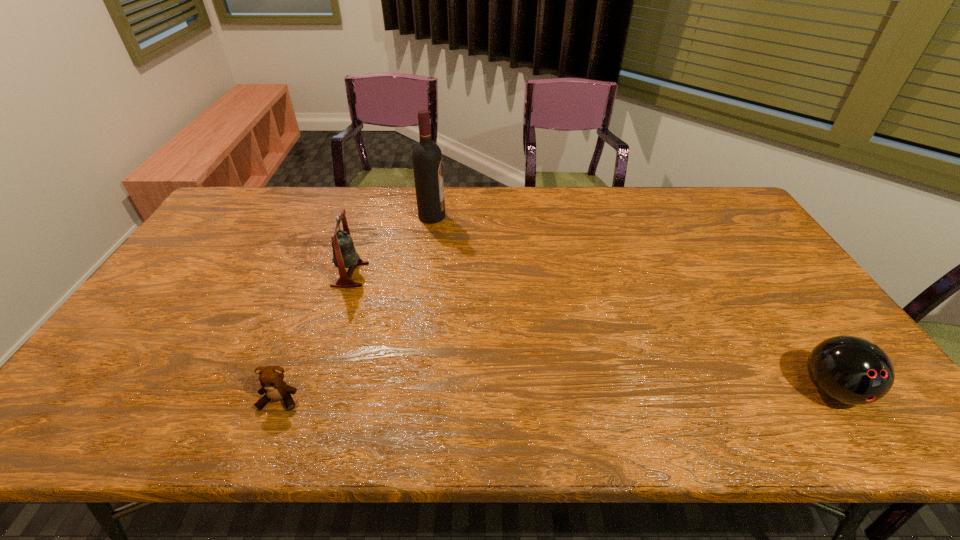
I want to click on the tallest object, so click(426, 156).

Locate an element on the screen. the second object from right to left is located at coordinates click(426, 156).

Locate an element on the screen. This screenshot has width=960, height=540. the third shortest object is located at coordinates click(344, 254).

At what (x,y) coordinates should I click in order to perform the action: click on the second farthest object. Please return your answer as a coordinate pair (x, y). Looking at the image, I should click on (344, 254).

The width and height of the screenshot is (960, 540). In order to click on the rightmost object in this screenshot , I will do `click(851, 370)`.

Find the location of `the third tallest object`. the third tallest object is located at coordinates (851, 370).

The height and width of the screenshot is (540, 960). I want to click on the shortest object, so pyautogui.click(x=271, y=378).

What are the coordinates of `vacant area situated on the label of the farthest object` in the screenshot? It's located at (558, 217).

You are a GUI agent. You are given a task and a screenshot of the screen. Output one action in this format:
    pyautogui.click(x=<x>, y=<y>)
    Task: Click on the vacant space located 0.400m on the left of the second tallest object
    The width and height of the screenshot is (960, 540).
    Given the screenshot: What is the action you would take?
    pyautogui.click(x=200, y=274)

I want to click on object at the far edge, so click(426, 156).